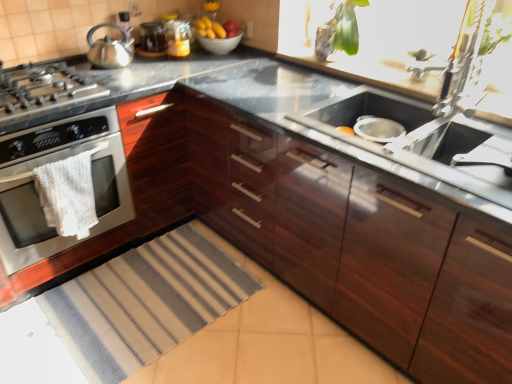
Find the location of a particular element. The image size is (512, 384). vacant area on top of glossy wood cabinets at center (from a real-world perspective) is located at coordinates (325, 104).